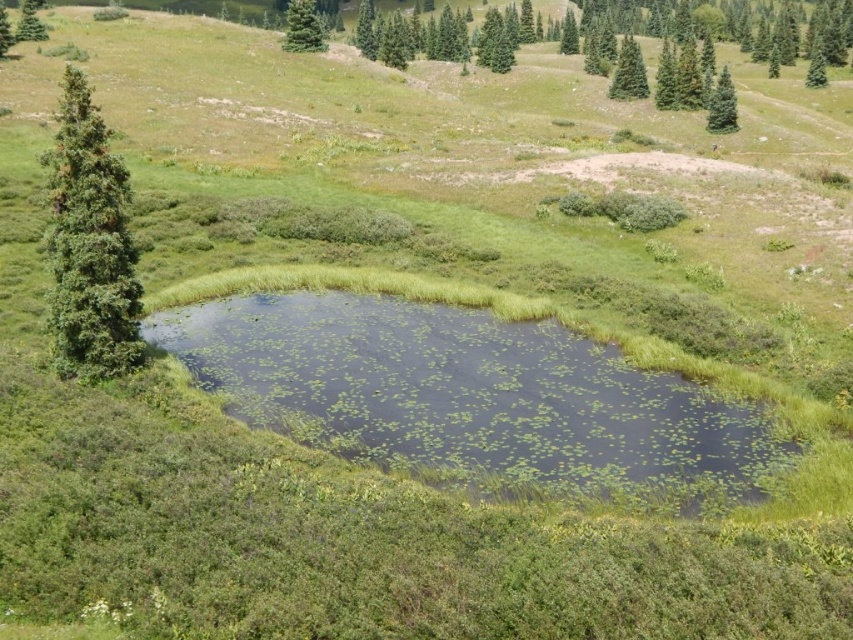
Question: Which of these objects is positioned farthest from the green matte evergreen tree at upper center?

Choices:
 (A) green textured tree at upper left
 (B) green textured pine tree at upper right
 (C) green leafy tree at left
 (D) green matte evergreen tree at upper right

Answer: (B)

Question: Does green textured tree at left have a larger size compared to green leafy tree at left?

Choices:
 (A) no
 (B) yes

Answer: (A)

Question: Where is green grassy lake at center located in relation to green fir tree at upper right in the image?

Choices:
 (A) left
 (B) right

Answer: (A)

Question: Among these points, which one is nearest to the camera?

Choices:
 (A) (820, 67)
 (B) (733, 406)

Answer: (B)

Question: Which is farther from the green textured tree at upper left?

Choices:
 (A) green fir tree at upper right
 (B) green textured pine tree at upper right
 (C) green matte evergreen tree at upper center

Answer: (B)

Question: Can you confirm if green matte evergreen tree at upper right is positioned to the right of green leafy tree at left?

Choices:
 (A) no
 (B) yes

Answer: (B)